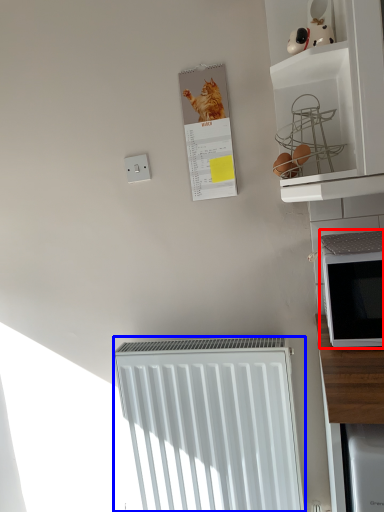
Question: Among these objects, which one is farthest to the camera, microwave oven (highlighted by a red box) or radiator (highlighted by a blue box)?

Choices:
 (A) microwave oven
 (B) radiator

Answer: (B)